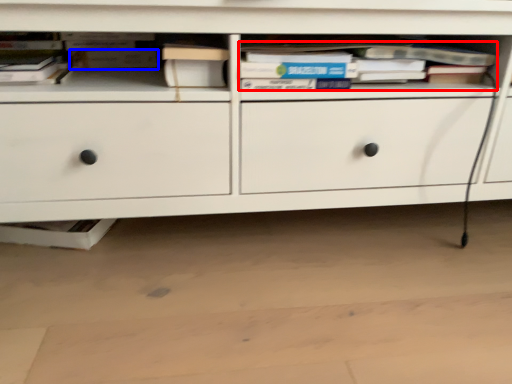
Question: Which of the following is the farthest to the observer, book (highlighted by a red box) or paperback book (highlighted by a blue box)?

Choices:
 (A) book
 (B) paperback book

Answer: (B)